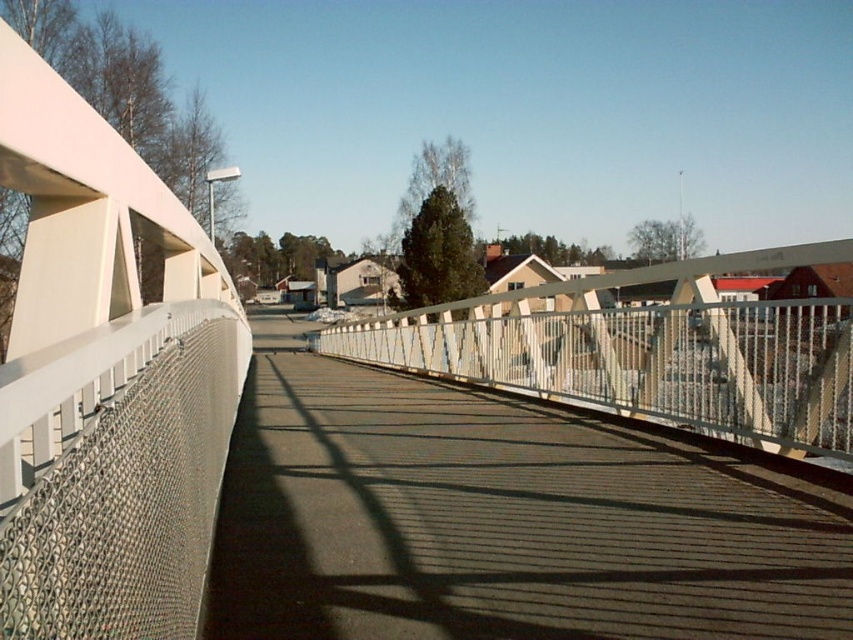
Is metallic mesh at center smaller than metallic mesh railing at center?

Correct, metallic mesh at center occupies less space than metallic mesh railing at center.

Is metallic mesh at center to the left of metallic mesh railing at center from the viewer's perspective?

No, metallic mesh at center is not to the left of metallic mesh railing at center.

Does point (543, 580) come farther from viewer compared to point (798, 360)?

No, it is in front of (798, 360).

This screenshot has width=853, height=640. Find the location of `metallic mesh at center`. metallic mesh at center is located at coordinates (503, 518).